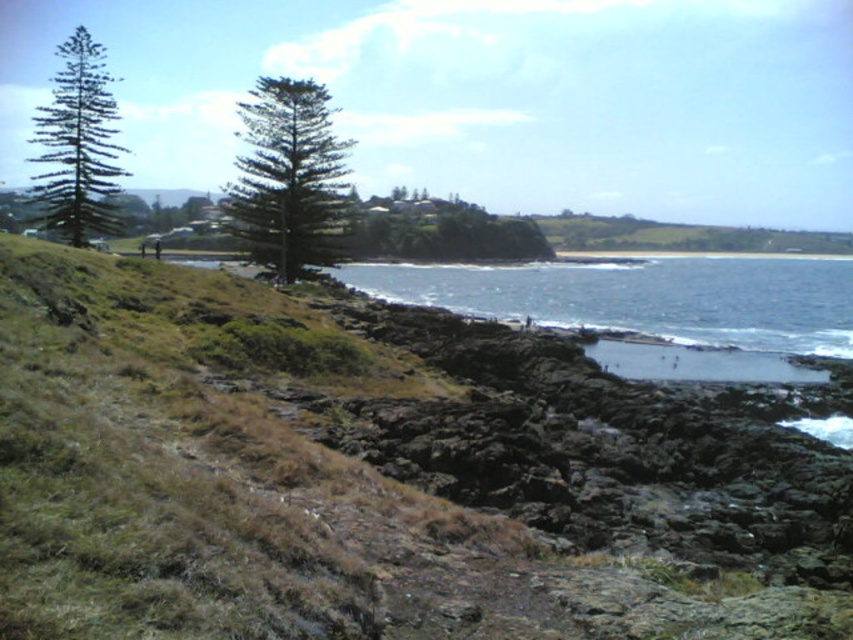
Question: Is green grassy hill at lower left further to camera compared to green needle-like foliage at upper left?

Choices:
 (A) no
 (B) yes

Answer: (A)

Question: Is clear blue water at lower right thinner than green needle-like foliage at center?

Choices:
 (A) no
 (B) yes

Answer: (A)

Question: Based on their relative distances, which object is nearer to the green needle-like foliage at upper left?

Choices:
 (A) green grassy hill at lower left
 (B) clear blue water at lower right
 (C) green needle-like foliage at center

Answer: (C)

Question: Which of the following is the farthest from the observer?

Choices:
 (A) green needle-like foliage at center
 (B) clear blue water at lower right

Answer: (A)

Question: Which point is closer to the camera?

Choices:
 (A) (560, 444)
 (B) (289, 86)

Answer: (A)

Question: Is green grassy hill at lower left wider than clear blue water at lower right?

Choices:
 (A) no
 (B) yes

Answer: (A)